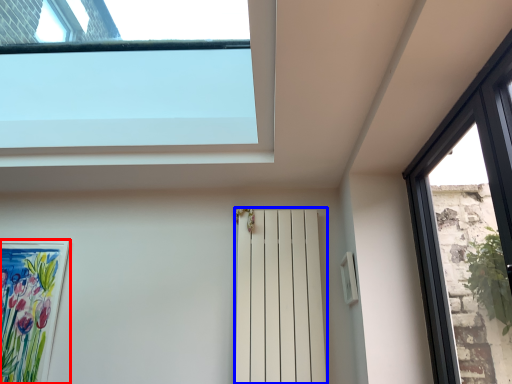
Question: Among these objects, which one is nearest to the camera, picture frame (highlighted by a red box) or shutter (highlighted by a blue box)?

Choices:
 (A) picture frame
 (B) shutter

Answer: (B)